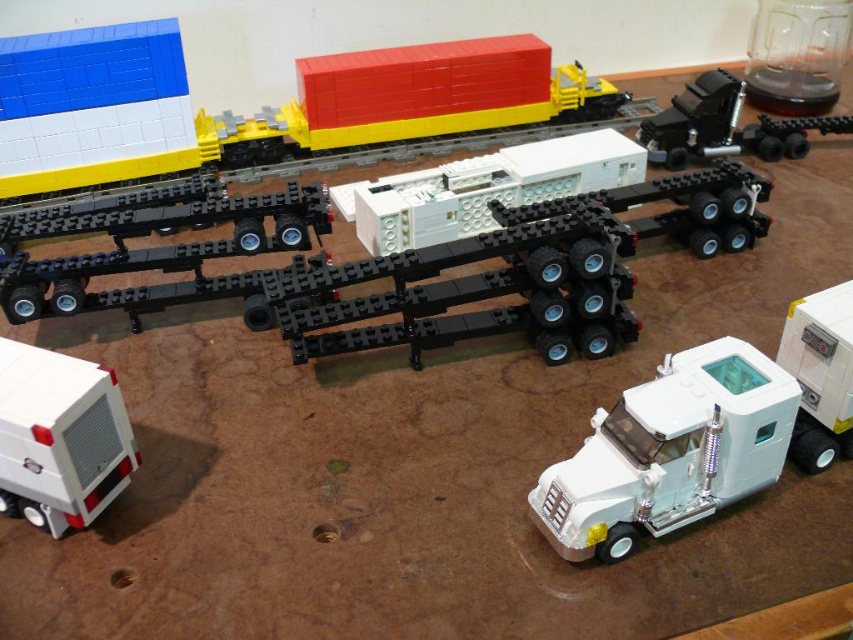
You are trying to attach the white matte truck at lower right to the white matte trailer at center. Based on their sizes, will the truck fit properly into the trailer?

The white matte trailer at center is wider than the white matte truck at lower right, so the truck should fit properly into the trailer since its width is smaller.

You are organizing a LEGO display and need to place the black rubber truck trailer at center and the white matte truck at lower right on a shelf. The shelf has limited space, and you want to ensure they fit without overlapping. Which object should be placed first to account for their sizes?

The black rubber truck trailer at center should be placed first because it has a larger size compared to the white matte truck at lower right, ensuring there is enough space for it on the shelf.

You are a delivery person who needs to load a package onto the white matte trailer at center from the white matte truck at lower right. Considering the space between them, can you safely move the package without it getting damaged?

The distance between the white matte trailer at center and the white matte truck at lower right is 14.65 inches, which provides sufficient space to safely move the package without damage.